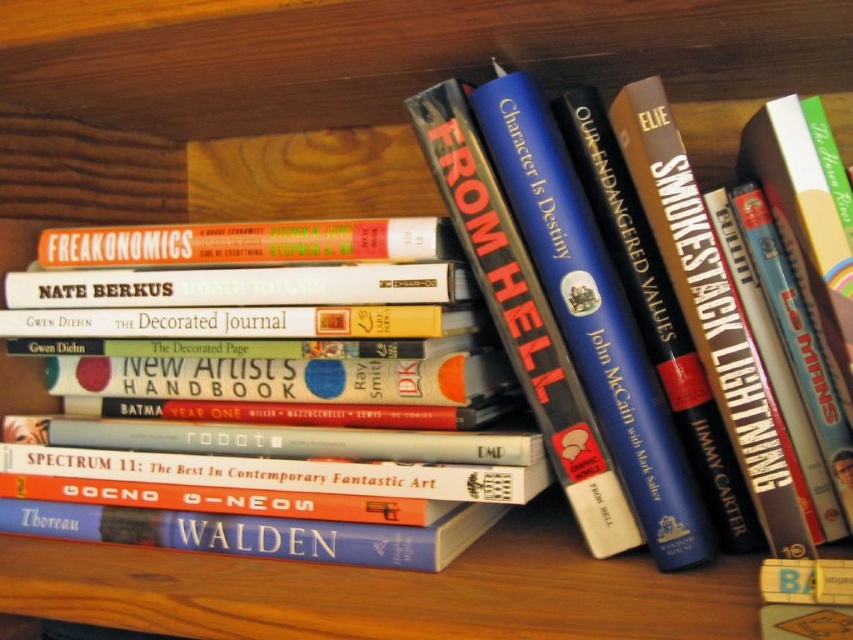
Question: Among these objects, which one is nearest to the camera?

Choices:
 (A) hardcover book at center
 (B) orange matte hardcover book at center
 (C) blue hardcover book at center

Answer: (C)

Question: Can you confirm if blue hardcover book at center is wider than hardcover book at center?

Choices:
 (A) no
 (B) yes

Answer: (B)

Question: Observing the image, what is the correct spatial positioning of blue hardcover book at center in reference to hardcover book at center?

Choices:
 (A) left
 (B) right

Answer: (B)

Question: Is blue hardcover book at center closer to camera compared to hardcover book at center?

Choices:
 (A) no
 (B) yes

Answer: (B)

Question: Which is farther from the orange matte hardcover book at center?

Choices:
 (A) hardcover book at center
 (B) blue hardcover book at center

Answer: (A)

Question: Which is farther from the orange matte hardcover book at center?

Choices:
 (A) blue hardcover book at center
 (B) hardcover book at center

Answer: (B)